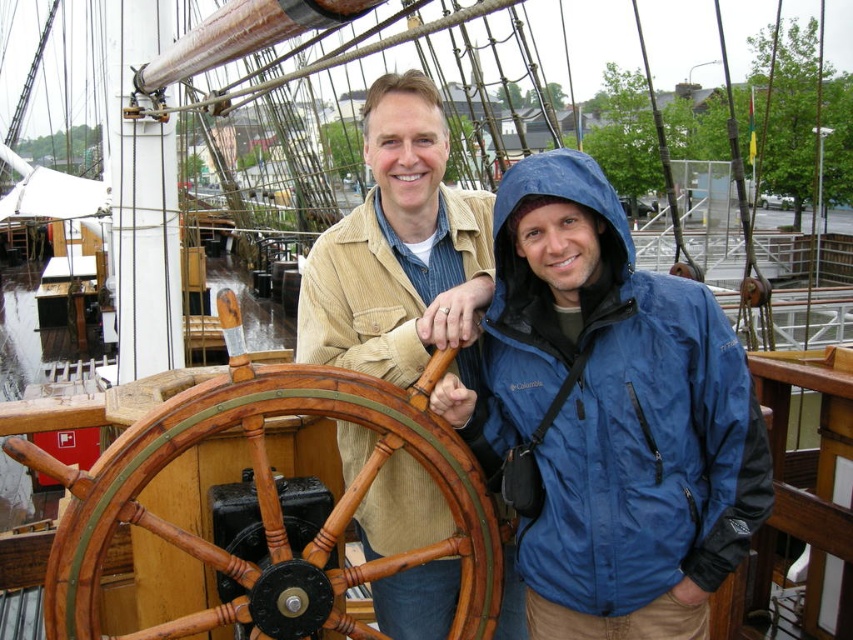
Is point (476, 566) positioned behind point (317, 276)?

No, (476, 566) is closer to viewer.

Does wooden polished ship's wheel at center have a smaller size compared to corduroy jacket at center?

Correct, wooden polished ship's wheel at center occupies less space than corduroy jacket at center.

Is point (305, 570) positioned after point (322, 276)?

That is False.

Identify the location of wooden polished ship's wheel at center. (271, 506).